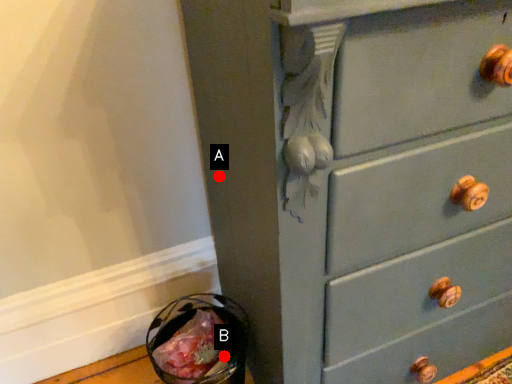
Question: Two points are circled on the image, labeled by A and B beside each circle. Which point is closer to the camera?

Choices:
 (A) A is closer
 (B) B is closer

Answer: (A)